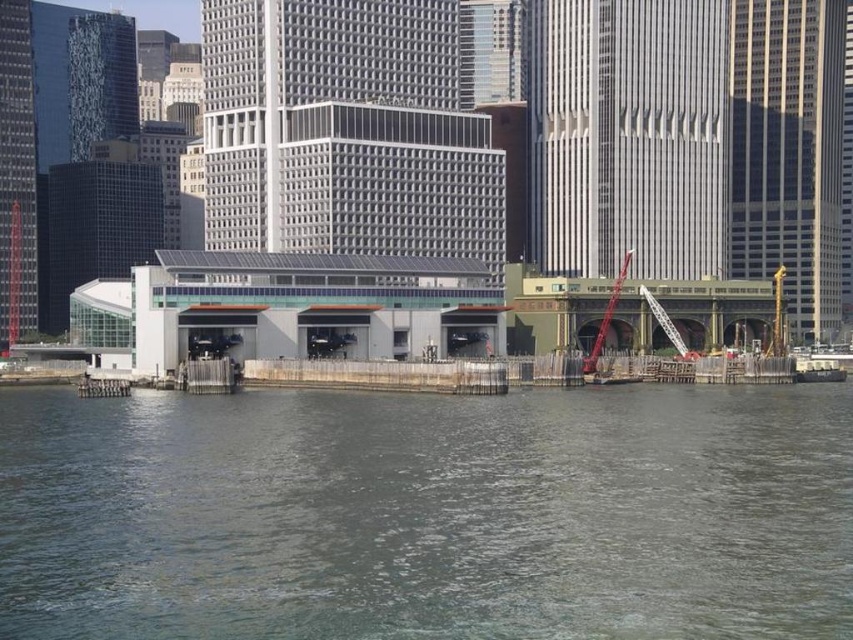
Which is more to the left, gray concrete river at lower center or red metallic crane at center right?

gray concrete river at lower center is more to the left.

Between gray concrete river at lower center and red metallic crane at center right, which one is positioned higher?

red metallic crane at center right

Locate an element on the screen. gray concrete river at lower center is located at coordinates (428, 515).

Can you confirm if gray concrete river at lower center is thinner than metallic gray crane at center right?

Incorrect, gray concrete river at lower center's width is not less than metallic gray crane at center right's.

Who is shorter, gray concrete river at lower center or metallic gray crane at center right?

Standing shorter between the two is gray concrete river at lower center.

Who is more distant from viewer, [422,541] or [641,291]?

Positioned behind is point [641,291].

Find the location of a particular element. gray concrete river at lower center is located at coordinates (428, 515).

In the scene shown: Does red metallic crane at center right appear on the right side of metallic gray crane at center right?

Incorrect, red metallic crane at center right is not on the right side of metallic gray crane at center right.

Who is positioned more to the right, red metallic crane at center right or metallic gray crane at center right?

metallic gray crane at center right

Who is more distant from viewer, (x=614, y=300) or (x=672, y=339)?

Positioned behind is point (x=614, y=300).

Where is `red metallic crane at center right`? This screenshot has height=640, width=853. red metallic crane at center right is located at coordinates (606, 317).